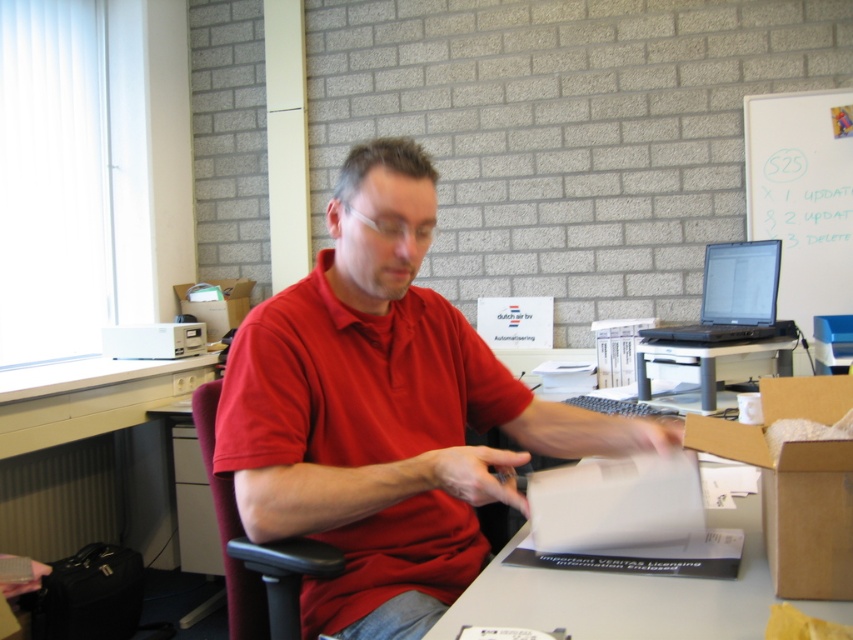
You are an office assistant who needs to retrieve the brown cardboard box at lower right. The box contains important documents. To reach it, you must first move items on the white plastic computer desk at lower left. Which object should you move first?

The brown cardboard box at lower right is positioned under the white plastic computer desk at lower left, so you need to move items from the white plastic computer desk at lower left first to access the box.

You are an office assistant who needs to deliver a message to the person at the desk. The message requires you to mention both the matte red shirt at center and the white paper at center. Based on their positions, which object should you point to first when addressing the person?

The matte red shirt at center is above the white paper at center, so you should point to the matte red shirt at center first as it is closer to the person.